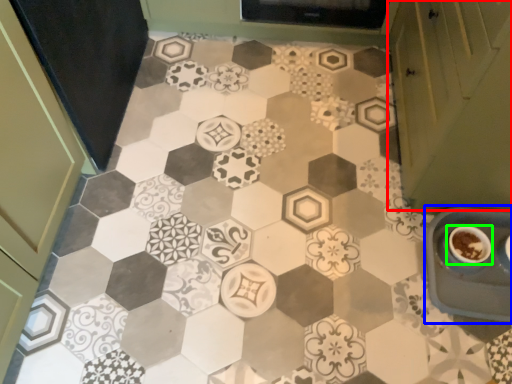
Question: Considering the real-world distances, which object is farthest from cabinetry (highlighted by a red box)? sink (highlighted by a blue box) or coffee cup (highlighted by a green box)?

Choices:
 (A) sink
 (B) coffee cup

Answer: (B)